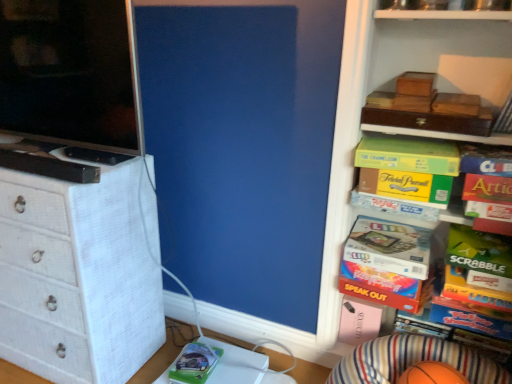
Question: From their relative heights in the image, would you say white woven chest of drawers at left is taller or shorter than matte black screen at left?

Choices:
 (A) tall
 (B) short

Answer: (A)

Question: Considering the relative positions of white woven chest of drawers at left and matte black screen at left in the image provided, is white woven chest of drawers at left to the left or to the right of matte black screen at left?

Choices:
 (A) left
 (B) right

Answer: (A)

Question: Considering the real-world distances, which object is farthest from the green cardboard book at upper right, arranged as the 1th book when viewed from the top?

Choices:
 (A) multicolored cardboard game at center right, which is counted as the fifth book, starting from the top
 (B) articulated paperboard game at right, which appears as the 3th book when viewed from the top
 (C) pink matte box at lower right, the first box in the back-to-front sequence
 (D) wooden box at upper right, the 1th storage box when ordered from top to bottom
 (E) orange rubber basketball at lower right

Answer: (C)

Question: Which object is positioned farthest from the matte black screen at left?

Choices:
 (A) yellow cardboard board game at upper right, the 4th book viewed from the top
 (B) green matte comic book at lower center
 (C) orange rubber basketball at lower right
 (D) white glossy computer desk at lower center
 (E) white woven chest of drawers at left

Answer: (C)